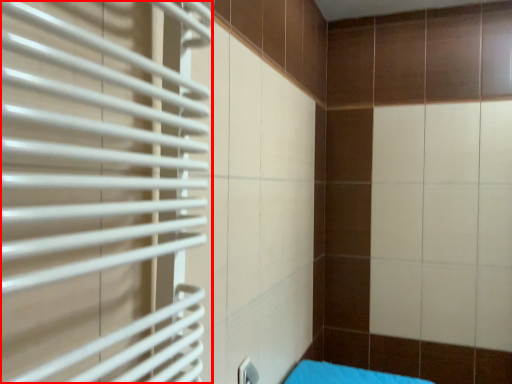
Question: Where is shutter (annotated by the red box) located in relation to furniture in the image?

Choices:
 (A) left
 (B) right

Answer: (A)